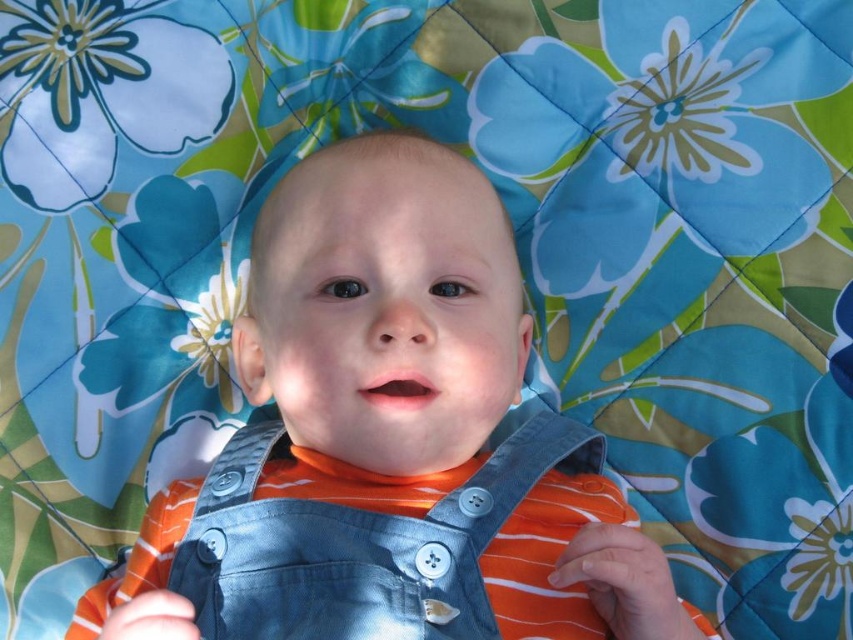
Question: Considering the relative positions of denim overalls at center and denim bib at center in the image provided, where is denim overalls at center located with respect to denim bib at center?

Choices:
 (A) left
 (B) right

Answer: (A)

Question: Can you confirm if denim overalls at center is positioned to the left of denim bib at center?

Choices:
 (A) no
 (B) yes

Answer: (B)

Question: Is denim overalls at center below denim bib at center?

Choices:
 (A) no
 (B) yes

Answer: (B)